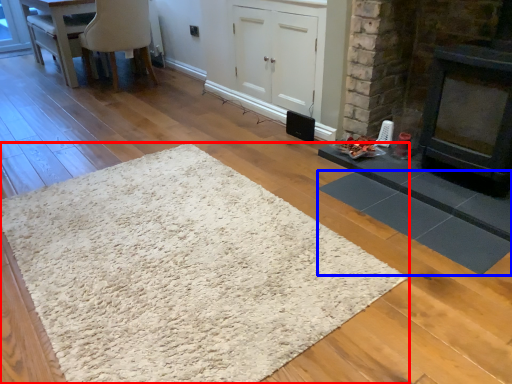
Question: Among these objects, which one is farthest to the camera, mat (highlighted by a red box) or mat (highlighted by a blue box)?

Choices:
 (A) mat
 (B) mat

Answer: (B)